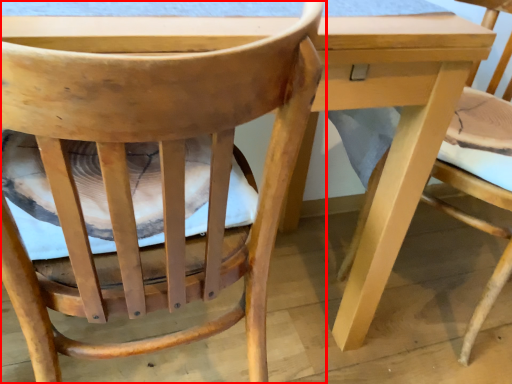
Question: From the image, what is the correct spatial relationship of chair (annotated by the red box) in relation to chair?

Choices:
 (A) right
 (B) left

Answer: (B)